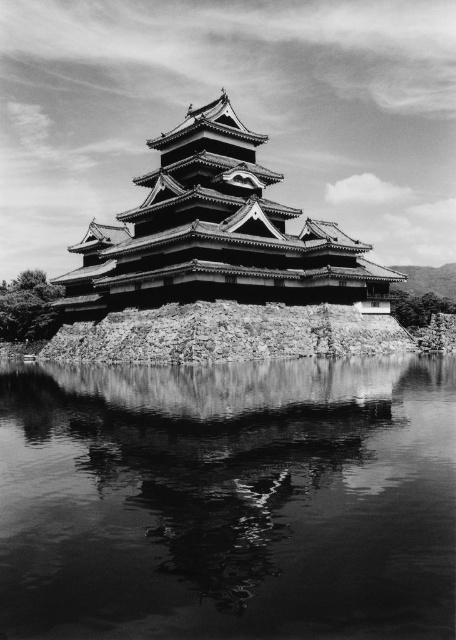
Question: Among these objects, which one is nearest to the camera?

Choices:
 (A) smooth reflective water at center
 (B) wooden pagoda at center

Answer: (A)

Question: Can you confirm if smooth reflective water at center is positioned to the right of wooden pagoda at center?

Choices:
 (A) no
 (B) yes

Answer: (B)

Question: In this image, where is smooth reflective water at center located relative to wooden pagoda at center?

Choices:
 (A) left
 (B) right

Answer: (B)

Question: Does smooth reflective water at center have a lesser width compared to wooden pagoda at center?

Choices:
 (A) yes
 (B) no

Answer: (A)